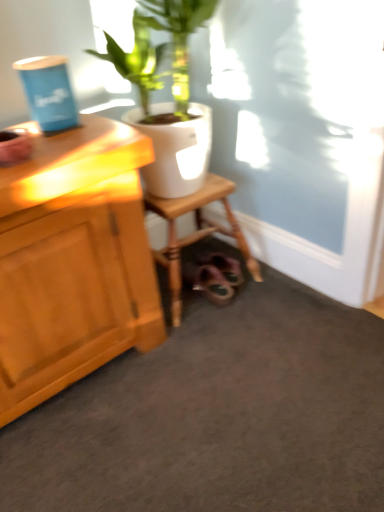
Question: From their relative heights in the image, would you say white glossy pot at upper center is taller or shorter than wooden stool at lower center?

Choices:
 (A) short
 (B) tall

Answer: (B)

Question: In terms of width, does white glossy pot at upper center look wider or thinner when compared to wooden stool at lower center?

Choices:
 (A) thin
 (B) wide

Answer: (B)

Question: From a real-world perspective, relative to wooden stool at lower center, is white glossy pot at upper center vertically above or below?

Choices:
 (A) above
 (B) below

Answer: (A)

Question: Is wooden stool at lower center to the left or to the right of white glossy pot at upper center in the image?

Choices:
 (A) left
 (B) right

Answer: (A)

Question: From the image's perspective, is wooden stool at lower center above or below white glossy pot at upper center?

Choices:
 (A) above
 (B) below

Answer: (B)

Question: Relative to white glossy pot at upper center, is wooden stool at lower center in front or behind?

Choices:
 (A) behind
 (B) front

Answer: (A)

Question: In terms of size, does wooden stool at lower center appear bigger or smaller than white glossy pot at upper center?

Choices:
 (A) small
 (B) big

Answer: (A)